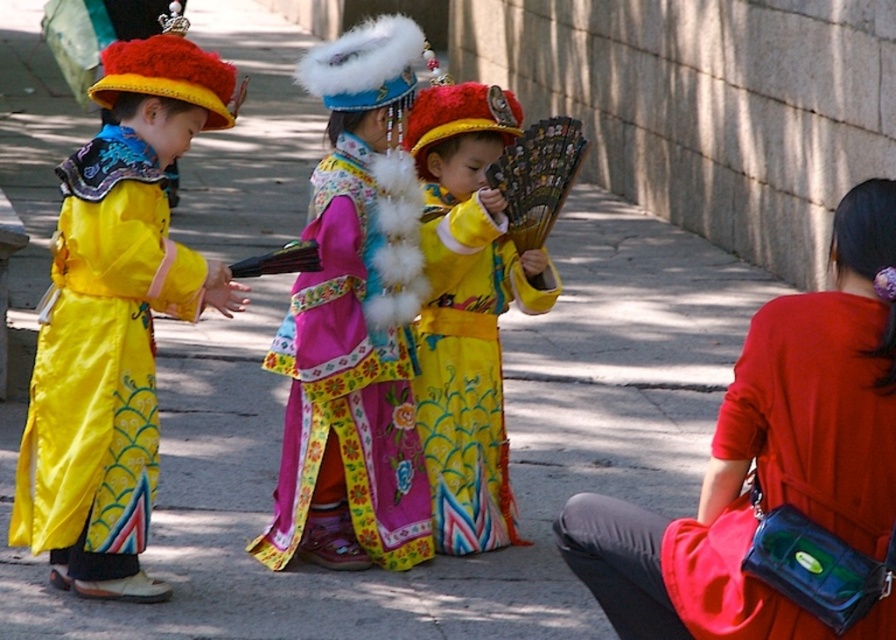
Which is behind, point (89, 364) or point (360, 461)?

Positioned behind is point (360, 461).

Which is more to the left, shiny yellow robe at left or floral satin robe at center?

From the viewer's perspective, shiny yellow robe at left appears more on the left side.

This screenshot has height=640, width=896. What do you see at coordinates (116, 317) in the screenshot?
I see `shiny yellow robe at left` at bounding box center [116, 317].

Locate an element on the screen. The image size is (896, 640). shiny yellow robe at left is located at coordinates (116, 317).

Between matte red shirt at right and floral satin robe at center, which one is positioned lower?

Positioned lower is matte red shirt at right.

Can you confirm if matte red shirt at right is thinner than floral satin robe at center?

Incorrect, matte red shirt at right's width is not less than floral satin robe at center's.

Where is `matte red shirt at right`? This screenshot has height=640, width=896. matte red shirt at right is located at coordinates (776, 474).

Where is `matte red shirt at right`? The width and height of the screenshot is (896, 640). matte red shirt at right is located at coordinates (776, 474).

Which of these two, floral satin robe at center or matte yellow costume at center, stands taller?

Standing taller between the two is matte yellow costume at center.

Is floral satin robe at center closer to the viewer compared to matte yellow costume at center?

Yes, it is in front of matte yellow costume at center.

Who is more forward, (369,212) or (423,228)?

Positioned in front is point (369,212).

This screenshot has height=640, width=896. In order to click on floral satin robe at center in this screenshot , I will do `click(355, 323)`.